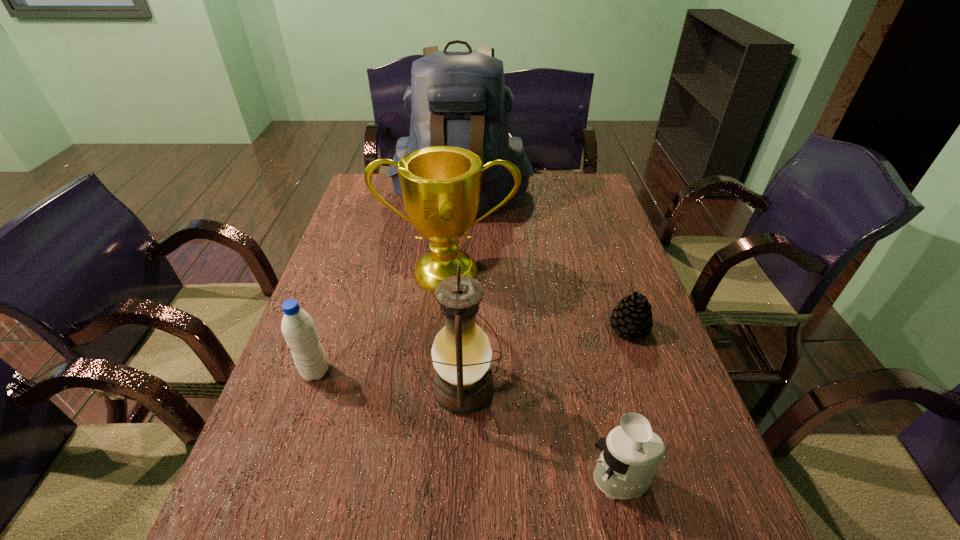
Locate an element on the screen. vacant area that lies between the fourth nearest object and the juicer is located at coordinates coord(625,404).

Identify the location of vacant space that is in between the fourth nearest object and the backpack. The image size is (960, 540). (545, 262).

I want to click on blank region between the oil lamp and the fourth nearest object, so click(x=546, y=357).

Where is `the fourth closest object relative to the leftmost object`? The image size is (960, 540). the fourth closest object relative to the leftmost object is located at coordinates (631, 454).

Find the location of a particular element. the second closest object relative to the oil lamp is located at coordinates [x=441, y=186].

Identify the location of vacant space that satisfies the following two spatial constraints: 1. at the front pocket of the oil lamp; 2. on the right side of the backpack. (449, 388).

Locate an element on the screen. vacant space that satisfies the following two spatial constraints: 1. on the shiny surface of the award; 2. on the right side of the fifth tallest object is located at coordinates (431, 480).